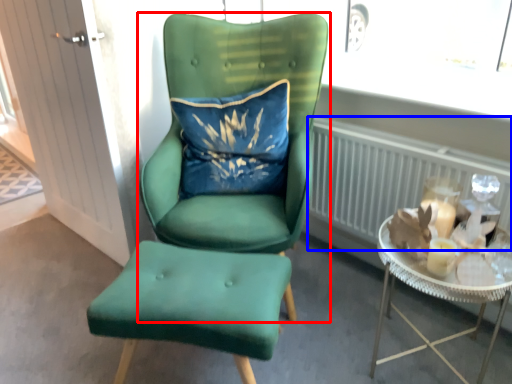
Question: Which object appears farthest to the camera in this image, chair (highlighted by a red box) or radiator (highlighted by a blue box)?

Choices:
 (A) chair
 (B) radiator

Answer: (B)